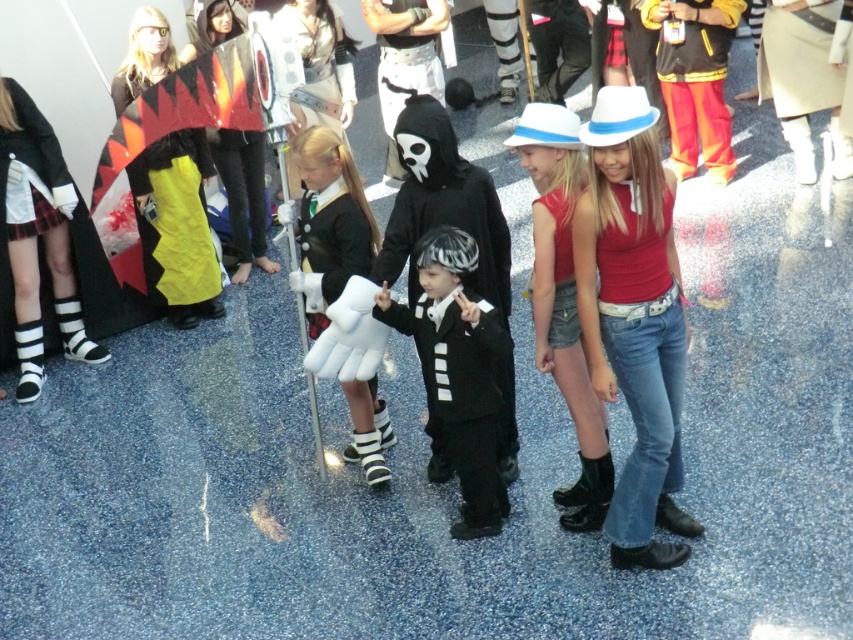
Question: Is denim jeans at center positioned behind black matte boots at lower left?

Choices:
 (A) yes
 (B) no

Answer: (B)

Question: Estimate the real-world distances between objects in this image. Which object is closer to the black matte boots at lower left?

Choices:
 (A) denim shorts at center
 (B) matte black suit at center
 (C) yellow fabric cape at center

Answer: (C)

Question: Is white matte gloves at center thinner than yellow fabric cape at center?

Choices:
 (A) no
 (B) yes

Answer: (B)

Question: Where is denim jeans at center located in relation to denim shorts at center in the image?

Choices:
 (A) below
 (B) above

Answer: (A)

Question: Which of the following is the farthest from the observer?

Choices:
 (A) (73, 221)
 (B) (219, 132)

Answer: (B)

Question: Which point appears closest to the camera in this image?

Choices:
 (A) (16, 193)
 (B) (596, 360)
 (C) (473, 397)

Answer: (B)